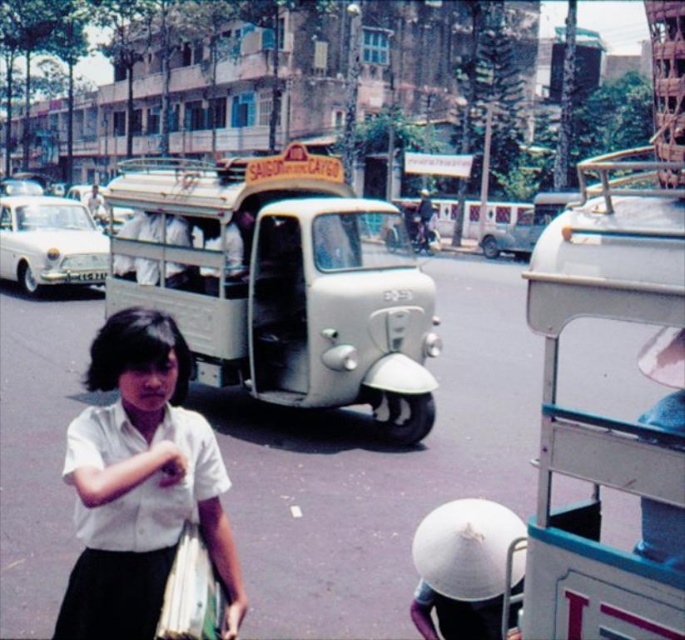
Does white cotton blouse at center have a greater height compared to white glossy car at left?

Correct, white cotton blouse at center is much taller as white glossy car at left.

Is point (221, 560) positioned before point (37, 276)?

Yes, it is in front of point (37, 276).

Is point (129, 596) closer to camera compared to point (86, 211)?

Yes, it is in front of point (86, 211).

Locate an element on the screen. white cotton blouse at center is located at coordinates (140, 484).